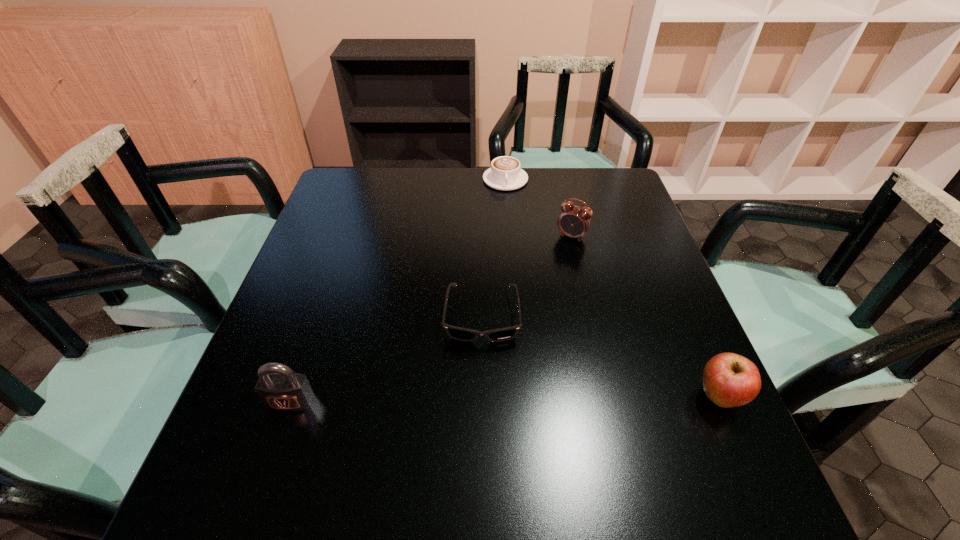
Image resolution: width=960 pixels, height=540 pixels. What are the coordinates of `object located at the right edge` in the screenshot? It's located at (730, 380).

This screenshot has height=540, width=960. What are the coordinates of `object that is at the near left corner` in the screenshot? It's located at (283, 390).

You are a GUI agent. You are given a task and a screenshot of the screen. Output one action in this format:
    pyautogui.click(x=<x>, y=<y>)
    Task: Click on the object that is at the near right corner
    Image resolution: width=960 pixels, height=540 pixels.
    Given the screenshot: What is the action you would take?
    pyautogui.click(x=730, y=380)

Find the location of a particular element. The width and height of the screenshot is (960, 540). free space at the far edge is located at coordinates (545, 200).

The image size is (960, 540). Identify the location of free space at the near edge of the desktop. (442, 410).

Identify the location of vacant region at the left edge of the desktop. Image resolution: width=960 pixels, height=540 pixels. (340, 293).

The height and width of the screenshot is (540, 960). Identify the location of vacant space at the right edge of the desktop. (671, 398).

Where is `vacant space at the far right corner of the desktop`? vacant space at the far right corner of the desktop is located at coordinates (582, 200).

In the image, there is a desktop. Identify the location of free space at the near right corner. (722, 426).

The width and height of the screenshot is (960, 540). Find the location of `free space between the sunglasses and the padlock`. free space between the sunglasses and the padlock is located at coordinates (386, 360).